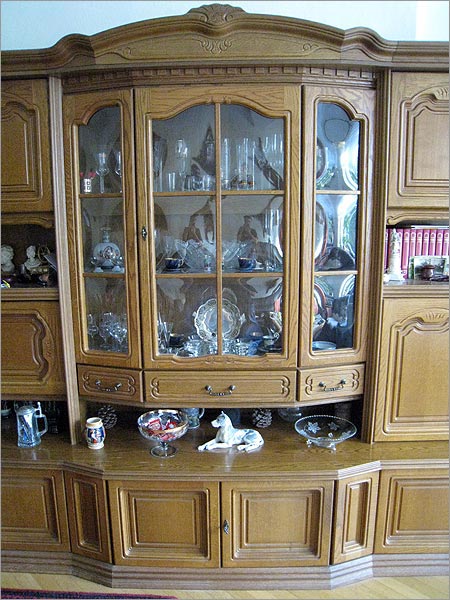
Where is `door`? This screenshot has width=450, height=600. door is located at coordinates (181, 528).